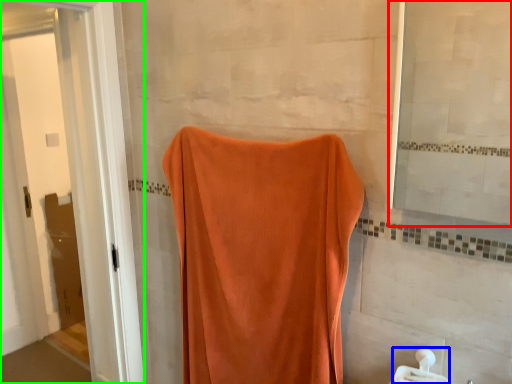
Question: Considering the real-world distances, which object is closest to mirror (highlighted by a red box)? towel bar (highlighted by a blue box) or screen door (highlighted by a green box).

Choices:
 (A) towel bar
 (B) screen door

Answer: (A)